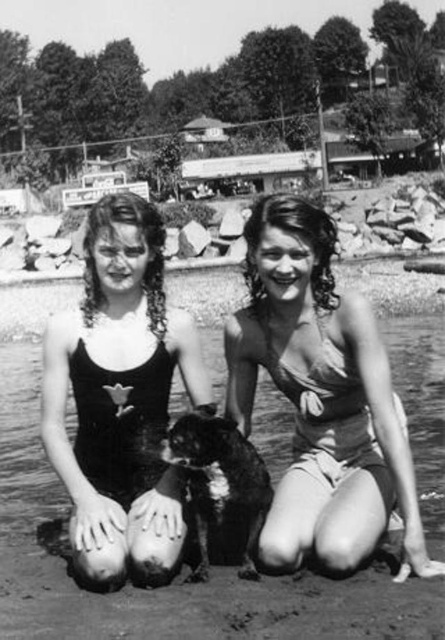
You are standing at the origin point in the image. You want to walk to the point at coordinates point (x=268, y=444). However, there is an obstacle at point (x=278, y=253). Based on the spatial relationship between these two points, will you be able to see the target point while avoiding the obstacle?

Point (x=268, y=444) is behind point (x=278, y=253), so if you avoid the obstacle at point (x=278, y=253), you will not be able to see the target point (x=268, y=444) because it is obstructed by the obstacle.

You are a photographer trying to capture a closeup of the smooth beige swimsuit at center. Based on the coordinates provided in the Objects Description, where should you position your camera relative to the two individuals and the dog?

The smooth beige swimsuit at center is located at point (322, 397), which is towards the lower right of the image. To capture a closeup, position your camera between the two individuals and slightly to the right of the dog to focus on the swimsuit at that coordinate.